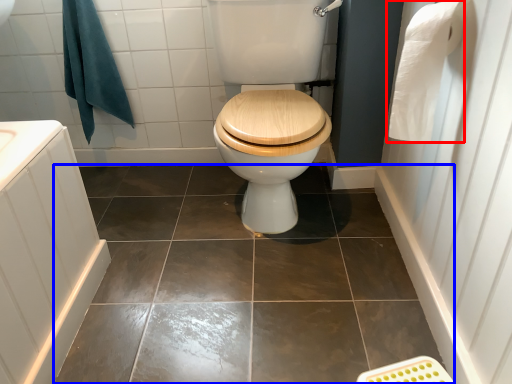
Question: Among these objects, which one is nearest to the camera, toilet paper (highlighted by a red box) or ceramic tile (highlighted by a blue box)?

Choices:
 (A) toilet paper
 (B) ceramic tile

Answer: (A)